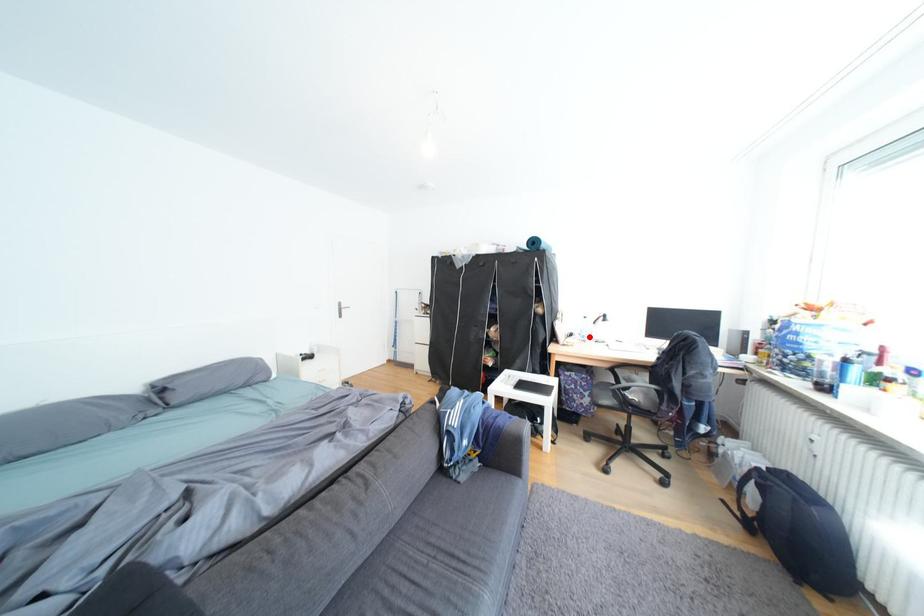
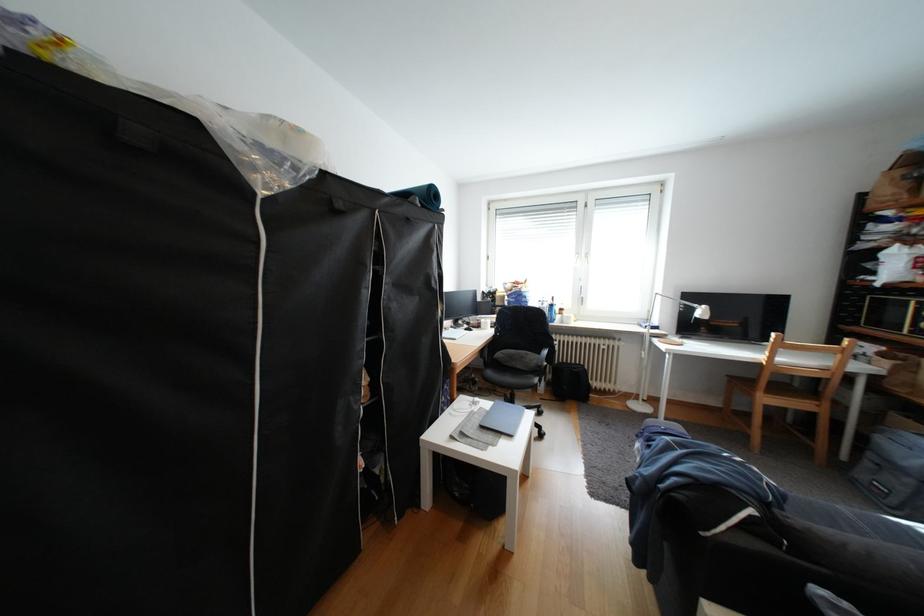
Question: I am providing you with two images of the same scene from different viewpoints. A red point is marked on the first image. Is the red point's position out of view in image 2?

Choices:
 (A) Yes
 (B) No

Answer: (A)